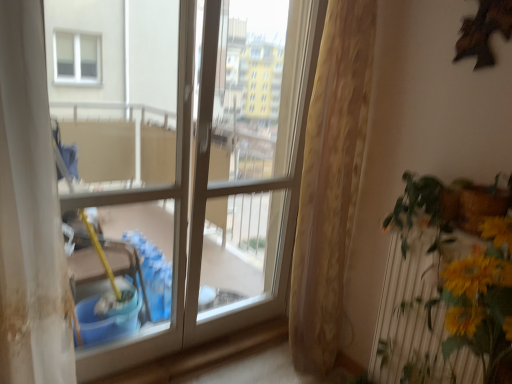
Question: Considering the positions of point (476, 369) and point (262, 269), is point (476, 369) closer or farther from the camera than point (262, 269)?

Choices:
 (A) closer
 (B) farther

Answer: (A)

Question: From a real-world perspective, relative to white glossy screen door at center, is yellow artificial flowers at right vertically above or below?

Choices:
 (A) above
 (B) below

Answer: (B)

Question: Based on their relative distances, which object is farther from the clear glass window at center?

Choices:
 (A) white glossy screen door at center
 (B) yellow artificial flowers at right
 (C) beige textured curtain at center

Answer: (B)

Question: Estimate the real-world distances between objects in this image. Which object is closer to the yellow artificial flowers at right?

Choices:
 (A) beige textured curtain at center
 (B) clear glass window at center
 (C) white glossy screen door at center

Answer: (A)